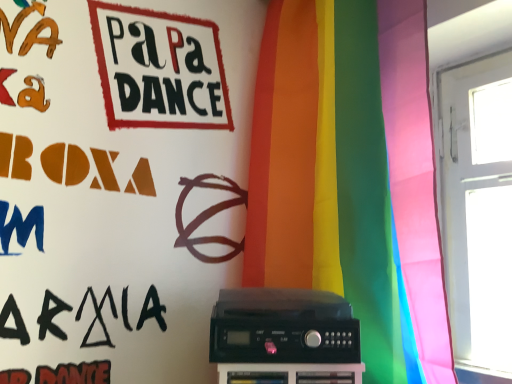
Question: From a real-world perspective, is black plastic amplifier at center physically located above or below rainbow fabric curtain at center?

Choices:
 (A) below
 (B) above

Answer: (A)

Question: Based on their positions, is black plastic amplifier at center located to the left or right of rainbow fabric curtain at center?

Choices:
 (A) left
 (B) right

Answer: (A)

Question: Considering the positions of point (330, 334) and point (266, 104), is point (330, 334) closer or farther from the camera than point (266, 104)?

Choices:
 (A) farther
 (B) closer

Answer: (B)

Question: Considering their positions, is rainbow fabric curtain at center located in front of or behind black plastic amplifier at center?

Choices:
 (A) front
 (B) behind

Answer: (A)

Question: Is point 413,54 closer or farther from the camera than point 266,304?

Choices:
 (A) closer
 (B) farther

Answer: (B)

Question: Looking at their shapes, would you say rainbow fabric curtain at center is wider or thinner than black plastic amplifier at center?

Choices:
 (A) thin
 (B) wide

Answer: (B)

Question: Is rainbow fabric curtain at center inside or outside of black plastic amplifier at center?

Choices:
 (A) inside
 (B) outside

Answer: (B)